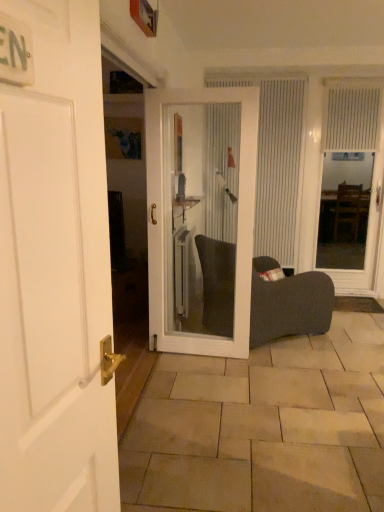
At what (x,y) coordinates should I click in order to perform the action: click on dark fabric chair at center. Please return your answer as a coordinate pair (x, y). Looking at the image, I should click on (288, 304).

Locate an element on the screen. The image size is (384, 512). transparent glass door at right is located at coordinates (356, 152).

Describe the element at coordinates (238, 219) in the screenshot. The image size is (384, 512). I see `white glossy door at center, which appears as the second door when viewed from the front` at that location.

Where is `white metallic radiator at center`? The height and width of the screenshot is (512, 384). white metallic radiator at center is located at coordinates (183, 272).

Consider the image. Can you tell me how much white matte door at left, the second door positioned from the back, and beige stone tile at lower center differ in facing direction?

The facing directions of white matte door at left, the second door positioned from the back, and beige stone tile at lower center are 170 degrees apart.

Is white matte door at left, the second door positioned from the back, wider or thinner than beige stone tile at lower center?

white matte door at left, the second door positioned from the back, is thinner than beige stone tile at lower center.

Can you confirm if white matte door at left, the second door positioned from the back, is positioned to the right of beige stone tile at lower center?

In fact, white matte door at left, the second door positioned from the back, is to the left of beige stone tile at lower center.

Is white metallic radiator at center with dark fabric chair at center?

No, white metallic radiator at center is not touching dark fabric chair at center.

Is white metallic radiator at center oriented away from dark fabric chair at center?

No, white metallic radiator at center's orientation is not away from dark fabric chair at center.

Looking at this image, is dark fabric chair at center located within white metallic radiator at center?

No.

Does dark fabric chair at center have a larger size compared to beige stone tile at lower center?

Indeed, dark fabric chair at center has a larger size compared to beige stone tile at lower center.

What are the coordinates of `tile below the dark fabric chair at center (from the image's perspective)` in the screenshot? It's located at (264, 428).

In the image, is dark fabric chair at center on the left side or the right side of beige stone tile at lower center?

dark fabric chair at center is to the left of beige stone tile at lower center.

Is dark fabric chair at center behind beige stone tile at lower center?

That is True.

Who is smaller, white glossy door at center, which appears as the second door when viewed from the front, or white textured curtain at upper right, the 1th curtain viewed from the right?

white textured curtain at upper right, the 1th curtain viewed from the right, is smaller.

Is white glossy door at center, the 1th door positioned from the back, taller or shorter than white textured curtain at upper right, which is the 2th curtain from left to right?

Answer: In the image, white glossy door at center, the 1th door positioned from the back, appears to be taller than white textured curtain at upper right, which is the 2th curtain from left to right.

From the image's perspective, which one is positioned higher, white glossy door at center, which appears as the second door when viewed from the front, or white textured curtain at upper right, the 1th curtain viewed from the right?

white textured curtain at upper right, the 1th curtain viewed from the right, is shown above in the image.

Which object is positioned more to the right, white glossy door at center, the 1th door positioned from the back, or white textured curtain at upper right, the 1th curtain viewed from the right?

Positioned to the right is white textured curtain at upper right, the 1th curtain viewed from the right.

Is white glossy door at center, which appears as the second door when viewed from the front, in contact with beige stone tile at lower center?

No, white glossy door at center, which appears as the second door when viewed from the front, is not in contact with beige stone tile at lower center.

Is white glossy door at center, which appears as the second door when viewed from the front, looking in the opposite direction of beige stone tile at lower center?

No, white glossy door at center, which appears as the second door when viewed from the front, is not facing the opposite direction of beige stone tile at lower center.

Which object is closer to the camera, white glossy door at center, the 1th door positioned from the back, or beige stone tile at lower center?

beige stone tile at lower center.

Looking at this image, is beige stone tile at lower center oriented towards white vertical blinds at center, which appears as the 2th curtain when viewed from the right?

No.

From the picture: Do you think beige stone tile at lower center is within white vertical blinds at center, which appears as the first curtain when viewed from the left, or outside of it?

The correct answer is: outside.

From the image's perspective, which one is positioned higher, beige stone tile at lower center or white vertical blinds at center, which appears as the 2th curtain when viewed from the right?

white vertical blinds at center, which appears as the 2th curtain when viewed from the right.

Can you confirm if dark fabric chair at center is bigger than white textured curtain at upper right, the 1th curtain viewed from the right?

Yes.

Does point (221, 323) come closer to viewer compared to point (375, 131)?

Yes, point (221, 323) is closer to viewer.

Does dark fabric chair at center turn towards white textured curtain at upper right, the 1th curtain viewed from the right?

No, dark fabric chair at center is not facing towards white textured curtain at upper right, the 1th curtain viewed from the right.

Find the location of a particular element. This screenshot has width=384, height=512. door that is the 1st object located above the beige stone tile at lower center (from the image's perspective) is located at coordinates (55, 270).

There is a dark fabric chair at center. Where is `radiator above it (from a real-world perspective)`? Image resolution: width=384 pixels, height=512 pixels. radiator above it (from a real-world perspective) is located at coordinates (183, 272).

Which object lies nearer to the anchor point white matte door at left, the second door positioned from the back, white vertical blinds at center, which appears as the 2th curtain when viewed from the right, or beige stone tile at lower center?

beige stone tile at lower center.

From the image, which object appears to be nearer to transparent glass door at right, white metallic radiator at center or white textured curtain at upper right, the 1th curtain viewed from the right?

white textured curtain at upper right, the 1th curtain viewed from the right, lies closer to transparent glass door at right than the other object.

When comparing their distances from white metallic radiator at center, does white matte door at left, which is counted as the 1th door, starting from the front, or transparent glass door at right seem further?

The object further to white metallic radiator at center is white matte door at left, which is counted as the 1th door, starting from the front.

Based on their spatial positions, is dark fabric chair at center or white textured curtain at upper right, the 1th curtain viewed from the right, further from transparent glass door at right?

The object further to transparent glass door at right is dark fabric chair at center.

Based on their spatial positions, is beige stone tile at lower center or white vertical blinds at center, which appears as the first curtain when viewed from the left, closer to white matte door at left, which is counted as the 1th door, starting from the front?

Among the two, beige stone tile at lower center is located nearer to white matte door at left, which is counted as the 1th door, starting from the front.

Looking at the image, which one is located closer to transparent glass door at right, white textured curtain at upper right, which is the 2th curtain from left to right, or white glossy door at center, which appears as the second door when viewed from the front?

Based on the image, white textured curtain at upper right, which is the 2th curtain from left to right, appears to be nearer to transparent glass door at right.

Consider the image. Which object lies further to the anchor point white matte door at left, the second door positioned from the back, white metallic radiator at center or transparent glass door at right?

Among the two, transparent glass door at right is located further to white matte door at left, the second door positioned from the back.

Looking at the image, which one is located closer to transparent glass door at right, beige stone tile at lower center or white vertical blinds at center, which appears as the 2th curtain when viewed from the right?

Answer: Based on the image, white vertical blinds at center, which appears as the 2th curtain when viewed from the right, appears to be nearer to transparent glass door at right.

Locate an element on the screen. The image size is (384, 512). radiator between white matte door at left, the second door positioned from the back, and transparent glass door at right, along the z-axis is located at coordinates (183, 272).

Identify the location of furniture between beige stone tile at lower center and white vertical blinds at center, which appears as the 2th curtain when viewed from the right, in the front-back direction. (288, 304).

Image resolution: width=384 pixels, height=512 pixels. Identify the location of furniture situated between white glossy door at center, which appears as the second door when viewed from the front, and transparent glass door at right from left to right. (288, 304).

The height and width of the screenshot is (512, 384). I want to click on door between beige stone tile at lower center and dark fabric chair at center from front to back, so click(x=238, y=219).